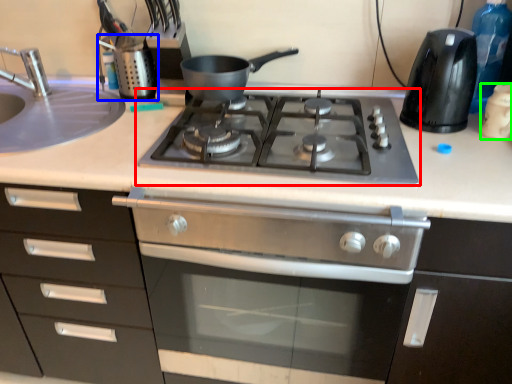
Question: Which is nearer to the gas stove (highlighted by a red box)? appliance (highlighted by a blue box) or kitchen appliance (highlighted by a green box).

Choices:
 (A) appliance
 (B) kitchen appliance

Answer: (A)